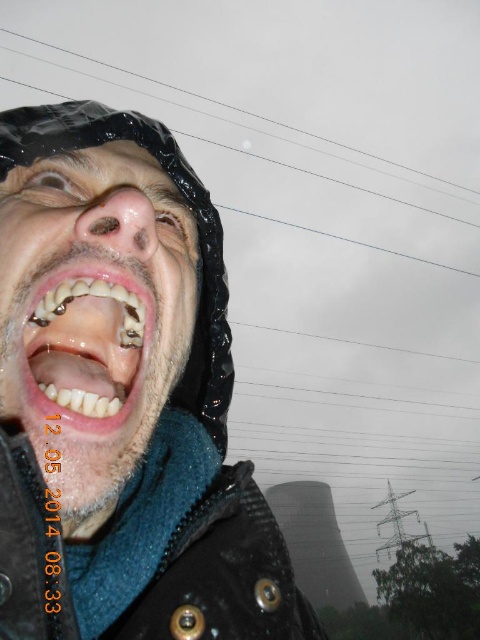
Can you confirm if shiny black jacket at center is positioned above white glossy teeth at center?

No, shiny black jacket at center is not above white glossy teeth at center.

Is shiny black jacket at center to the right of white glossy teeth at center from the viewer's perspective?

Yes, shiny black jacket at center is to the right of white glossy teeth at center.

Is point (84, 612) positioned in front of point (107, 396)?

No, it is behind (107, 396).

Where is `shiny black jacket at center`? The height and width of the screenshot is (640, 480). shiny black jacket at center is located at coordinates (121, 397).

Identify the location of shiny black jacket at center. (121, 397).

Which of these two, shiny black jacket at center or transparent plastic power line at upper center, stands shorter?

With less height is shiny black jacket at center.

Is point (12, 577) behind point (479, 193)?

No, it is in front of (479, 193).

At what (x,y) coordinates should I click in order to perform the action: click on shiny black jacket at center. Please return your answer as a coordinate pair (x, y). Looking at the image, I should click on (121, 397).

Does shiny black jacket at center appear on the left side of shiny metallic face at center?

No, shiny black jacket at center is not to the left of shiny metallic face at center.

Who is more distant from viewer, [230,614] or [152,380]?

Point [152,380]

The height and width of the screenshot is (640, 480). Describe the element at coordinates (121, 397) in the screenshot. I see `shiny black jacket at center` at that location.

This screenshot has height=640, width=480. I want to click on shiny black jacket at center, so click(121, 397).